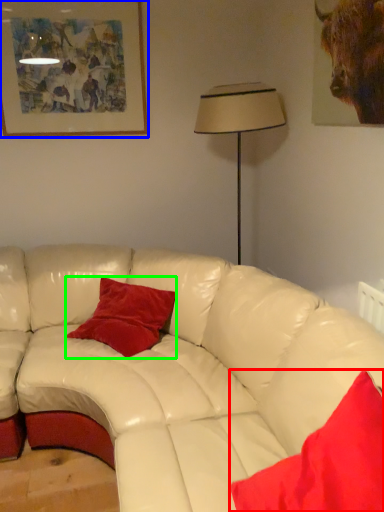
Question: Which object is the farthest from pillow (highlighted by a red box)? Choose among these: picture frame (highlighted by a blue box) or pillow (highlighted by a green box).

Choices:
 (A) picture frame
 (B) pillow

Answer: (A)